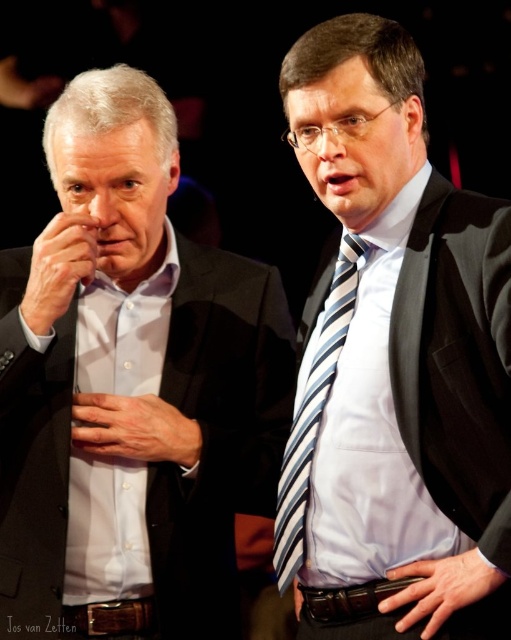
Question: Is matte black suit at center to the left of smooth skin hand at left from the viewer's perspective?

Choices:
 (A) yes
 (B) no

Answer: (B)

Question: Does matte black suit at left have a greater width compared to blue striped tie at center?

Choices:
 (A) yes
 (B) no

Answer: (A)

Question: Considering the relative positions of smooth skin hand at left and smooth leather hand at center in the image provided, where is smooth skin hand at left located with respect to smooth leather hand at center?

Choices:
 (A) right
 (B) left

Answer: (B)

Question: Estimate the real-world distances between objects in this image. Which object is closer to the matte glass nose at center?

Choices:
 (A) smooth skin hand at center
 (B) matte skin nose at center
 (C) smooth skin hand at left
 (D) matte black suit at center

Answer: (B)

Question: Estimate the real-world distances between objects in this image. Which object is farther from the smooth leather hand at center?

Choices:
 (A) matte black suit at center
 (B) matte glass nose at center
 (C) blue striped tie at center
 (D) smooth skin hand at center

Answer: (B)

Question: Estimate the real-world distances between objects in this image. Which object is farther from the smooth skin hand at left?

Choices:
 (A) smooth skin hand at center
 (B) matte glass nose at center
 (C) blue striped tie at center
 (D) matte black suit at left

Answer: (B)